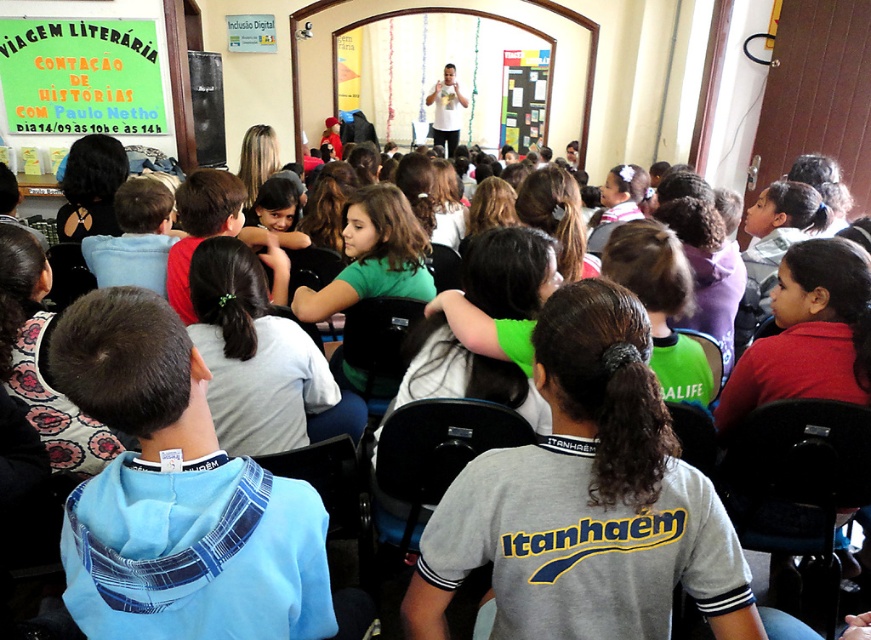
Question: Is black plastic chair at center above green fabric chair at center?

Choices:
 (A) no
 (B) yes

Answer: (B)

Question: Does blue plaid hoodie at center have a lesser width compared to matte white shirt at center?

Choices:
 (A) no
 (B) yes

Answer: (B)

Question: Which object is the closest to the matte white shirt at center?

Choices:
 (A) green fabric chair at center
 (B) black plastic chair at lower right
 (C) green paperboard sign at upper left
 (D) gray fabric shirt at center

Answer: (C)

Question: Which is nearer to the green fabric chair at center?

Choices:
 (A) matte white shirt at center
 (B) black plastic chair at center
 (C) green paperboard sign at upper left
 (D) black plastic chair at lower right

Answer: (D)

Question: Among these objects, which one is nearest to the camera?

Choices:
 (A) matte white shirt at center
 (B) gray fabric shirt at center
 (C) green paperboard sign at upper left

Answer: (B)

Question: Does matte white shirt at center have a larger size compared to green fabric chair at center?

Choices:
 (A) no
 (B) yes

Answer: (B)